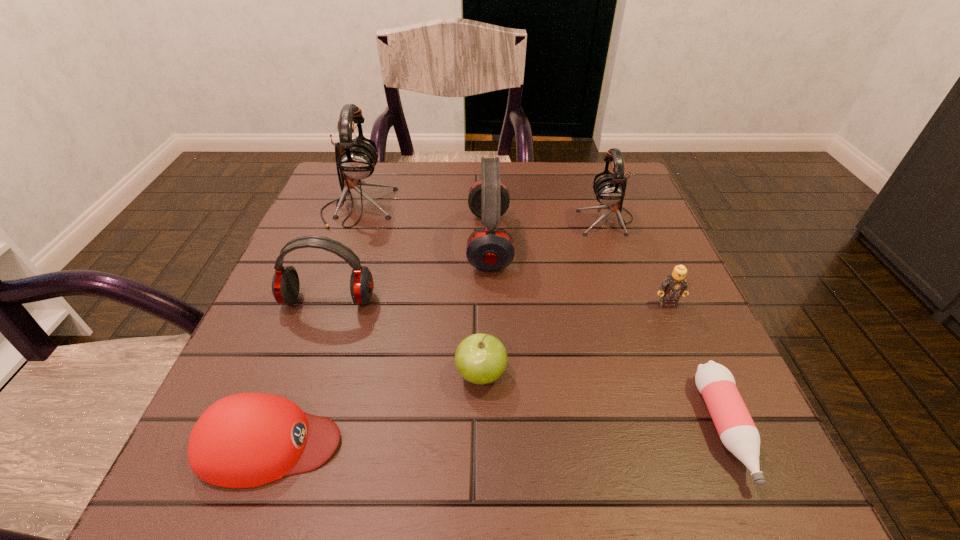
Locate an element on the screen. The image size is (960, 540). baseball cap is located at coordinates (245, 440).

The height and width of the screenshot is (540, 960). I want to click on pink bottle, so 737,431.

Where is `the shortest object`? This screenshot has width=960, height=540. the shortest object is located at coordinates (737, 431).

Locate an element on the screen. The image size is (960, 540). free space located 0.130m on the front of the tallest earphone is located at coordinates (337, 267).

I want to click on free space located 0.210m on the ear cups of the third earphone from left to right, so pyautogui.click(x=372, y=241).

Where is `vacant space located 0.130m on the ear cups of the third earphone from left to right`? The height and width of the screenshot is (540, 960). vacant space located 0.130m on the ear cups of the third earphone from left to right is located at coordinates click(x=409, y=241).

I want to click on vacant space located 0.050m on the ear cups of the third earphone from left to right, so click(444, 241).

Where is `blank space located 0.240m on the left of the right black earphone`? The image size is (960, 540). blank space located 0.240m on the left of the right black earphone is located at coordinates (x=475, y=219).

The image size is (960, 540). What are the coordinates of `vacant space located on the ear cups of the fifth shortest object` in the screenshot? It's located at (300, 383).

Where is `vacant area situated 0.050m on the front of the green apple`? The height and width of the screenshot is (540, 960). vacant area situated 0.050m on the front of the green apple is located at coordinates (481, 427).